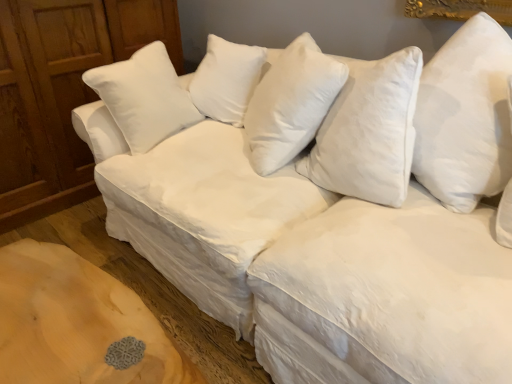
Question: Considering the positions of point (287, 49) and point (490, 193), is point (287, 49) closer or farther from the camera than point (490, 193)?

Choices:
 (A) closer
 (B) farther

Answer: (B)

Question: In terms of height, does white soft pillow at center, the 1th pillow from the left, look taller or shorter compared to white soft pillow at upper right, acting as the first pillow starting from the front?

Choices:
 (A) short
 (B) tall

Answer: (A)

Question: Estimate the real-world distances between objects in this image. Which object is farther from the wooden dresser at left?

Choices:
 (A) white soft pillow at center, the 1th pillow from the left
 (B) white soft pillow at upper right, marked as the 1th pillow in a right-to-left arrangement

Answer: (B)

Question: Based on their relative distances, which object is nearer to the white soft pillow at center, the second pillow when ordered from right to left?

Choices:
 (A) white soft pillow at upper right, acting as the first pillow starting from the front
 (B) wooden dresser at left

Answer: (A)